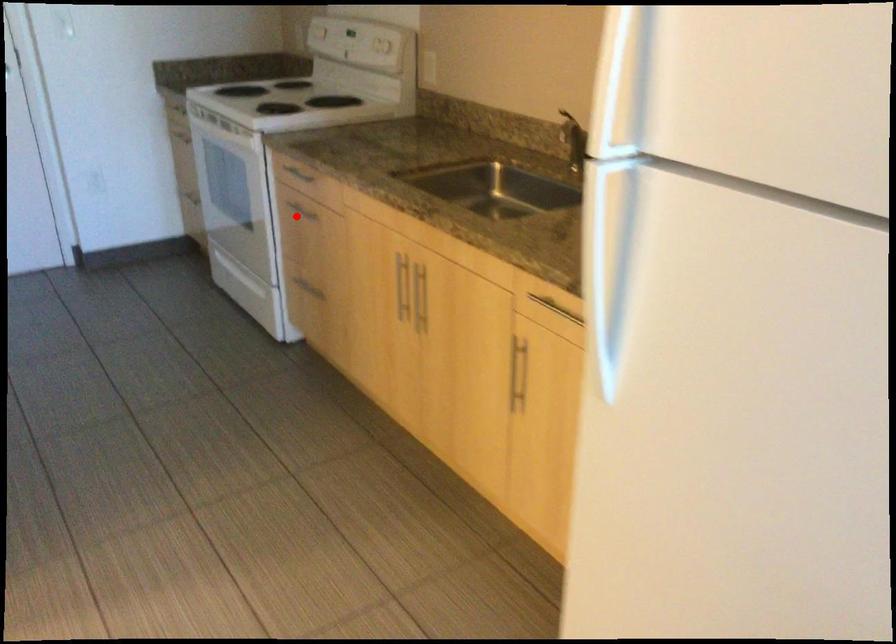
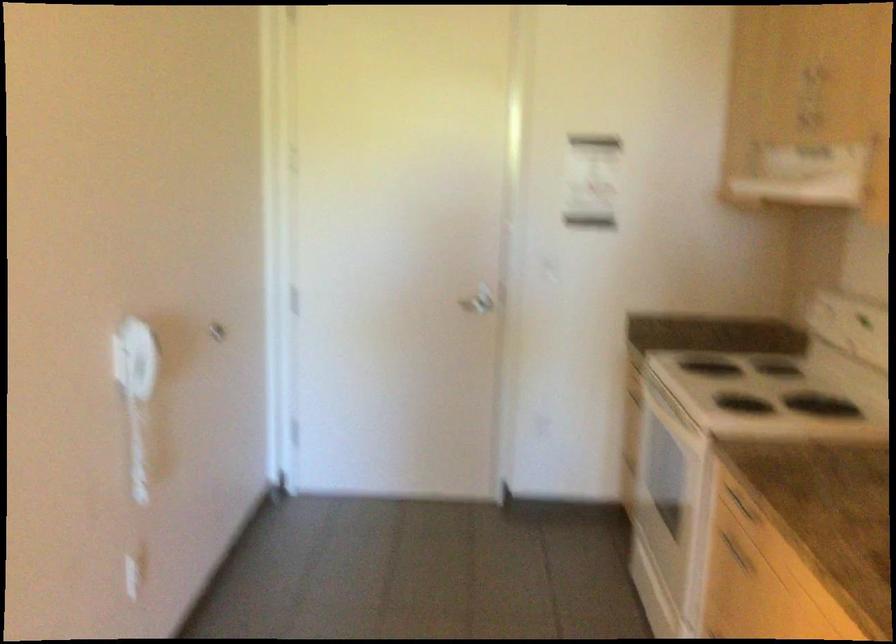
Question: I am providing you with two images of the same scene from different viewpoints. Given a red point in image1, look at the same physical point in image2. Is it:

Choices:
 (A) Closer to the viewpoint
 (B) Farther from the viewpoint

Answer: (A)